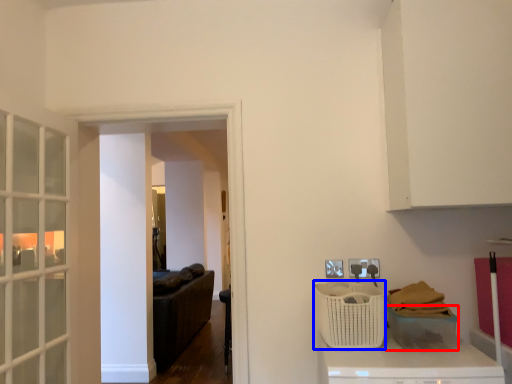
Question: Which object appears closest to the camera in this image, basket (highlighted by a red box) or basket (highlighted by a blue box)?

Choices:
 (A) basket
 (B) basket

Answer: (A)